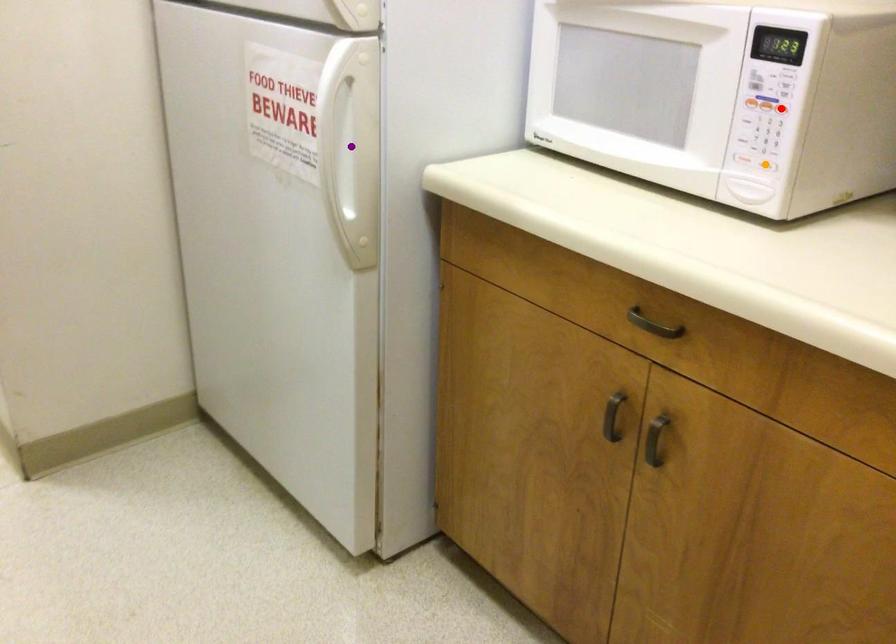
Order these from farthest to nearest:
orange point, red point, purple point

purple point → orange point → red point